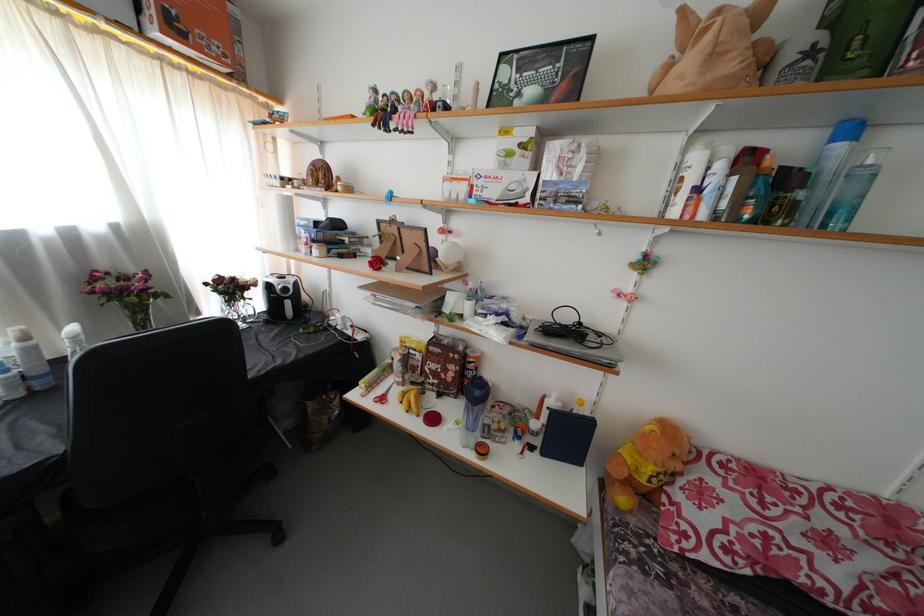
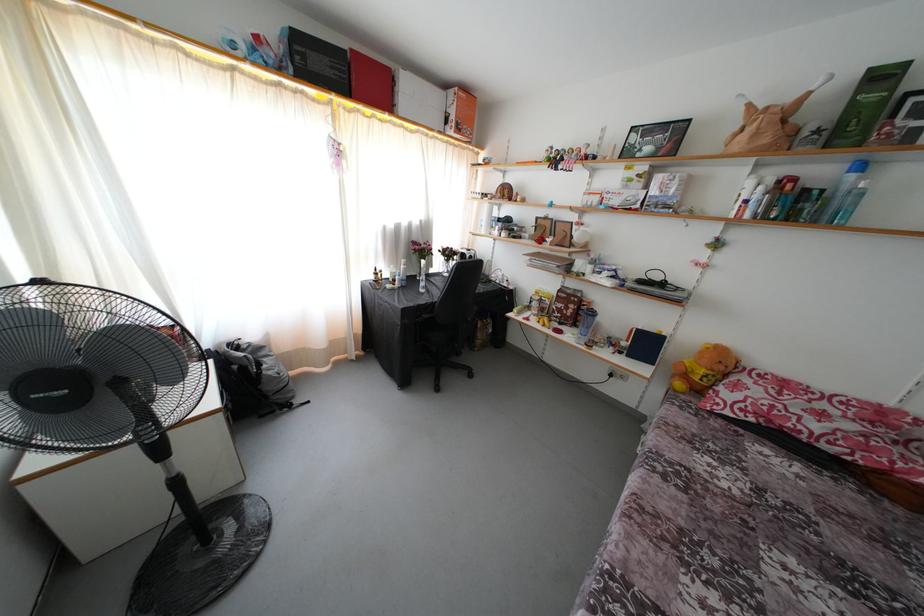
In the second image, find the point that corresponds to (x=831, y=138) in the first image.

(849, 172)